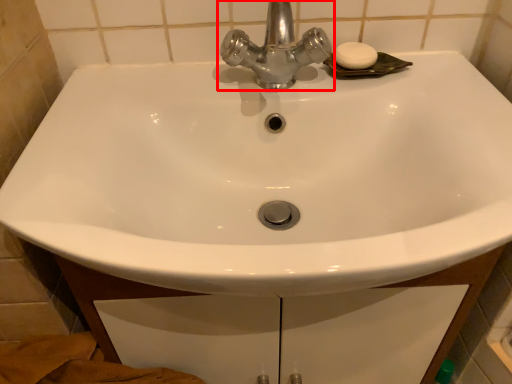
Question: Considering the relative positions of tap (annotated by the red box) and soap in the image provided, where is tap (annotated by the red box) located with respect to the staircase?

Choices:
 (A) left
 (B) right

Answer: (A)